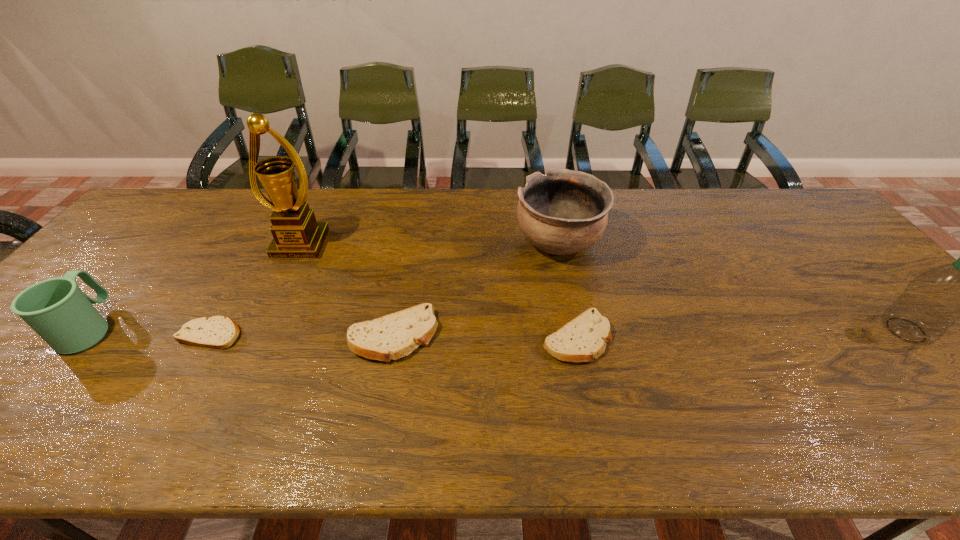
The pita breads are evenly distributed in the image. To maintain this, where would you place another pita bread on the right? Please point to a free space. Please provide its 2D coordinates. Your answer should be formatted as a tuple, i.e. [(x, y)], where the tuple contains the x and y coordinates of a point satisfying the conditions above.

[(762, 340)]